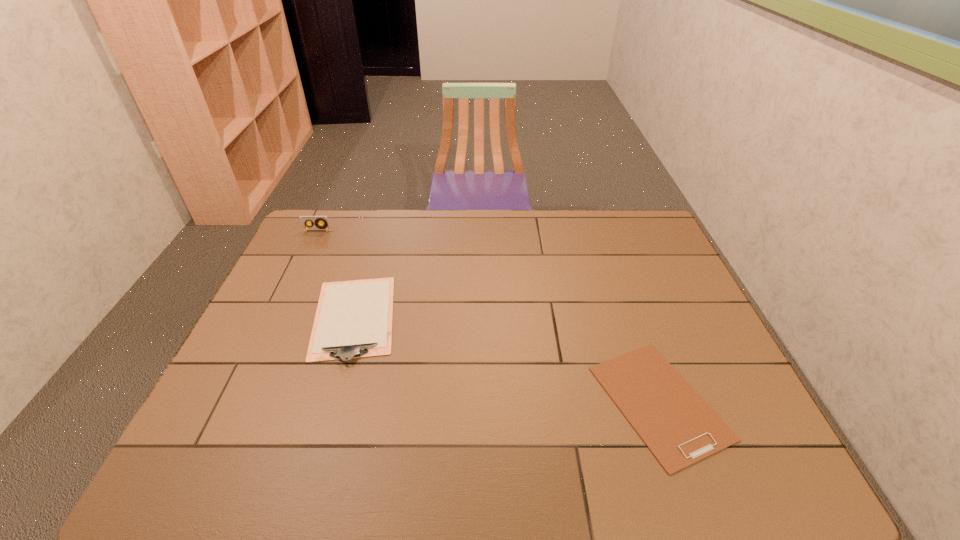
Identify the location of free space between the rightmost object and the farthest object. (489, 316).

Find the location of a particular element. empty location between the shorter clipboard and the taller clipboard is located at coordinates (507, 360).

In order to click on vacant space that is in between the videotape and the right clipboard in this screenshot , I will do [489, 316].

At what (x,y) coordinates should I click in order to perform the action: click on object that stands as the second closest to the left clipboard. Please return your answer as a coordinate pair (x, y). The width and height of the screenshot is (960, 540). Looking at the image, I should click on (676, 424).

Point out which object is positioned as the nearest to the right clipboard. Please provide its 2D coordinates. Your answer should be formatted as a tuple, i.e. [(x, y)], where the tuple contains the x and y coordinates of a point satisfying the conditions above.

[(353, 319)]

In order to click on free space in the image that satisfies the following two spatial constraints: 1. at the front of the rightmost object with visible reels; 2. on the right side of the videotape in this screenshot , I will do `click(235, 402)`.

Identify the location of free space that satisfies the following two spatial constraints: 1. at the front of the tallest object with visible reels; 2. on the right side of the second object from left to right. The height and width of the screenshot is (540, 960). (276, 318).

Where is `vacant area that satisfies the following two spatial constraints: 1. at the front of the farthest object with visible reels; 2. on the right side of the shorter clipboard`? Image resolution: width=960 pixels, height=540 pixels. vacant area that satisfies the following two spatial constraints: 1. at the front of the farthest object with visible reels; 2. on the right side of the shorter clipboard is located at coordinates (235, 402).

At what (x,y) coordinates should I click in order to perform the action: click on vacant region that satisfies the following two spatial constraints: 1. at the front of the farthest object with visible reels; 2. on the left side of the right clipboard. Please return your answer as a coordinate pair (x, y). Looking at the image, I should click on (235, 402).

Image resolution: width=960 pixels, height=540 pixels. I want to click on vacant region that satisfies the following two spatial constraints: 1. at the front of the tallest object with visible reels; 2. on the right side of the left clipboard, so click(276, 318).